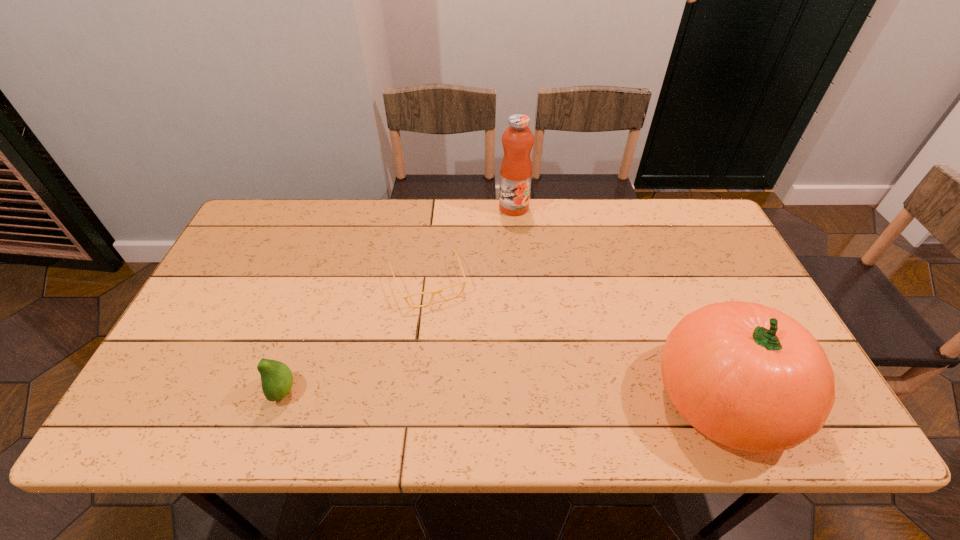
This screenshot has width=960, height=540. Find the location of `avocado`. avocado is located at coordinates (276, 377).

At what (x,y) coordinates should I click in order to perform the action: click on the leftmost object. Please return your answer as a coordinate pair (x, y). Looking at the image, I should click on (276, 377).

Locate an element on the screen. the rightmost object is located at coordinates (748, 376).

Find the location of a particular element. The height and width of the screenshot is (540, 960). the second tallest object is located at coordinates (748, 376).

Image resolution: width=960 pixels, height=540 pixels. I want to click on the second farthest object, so click(x=438, y=291).

The height and width of the screenshot is (540, 960). I want to click on the shortest object, so click(x=438, y=291).

You are a GUI agent. You are given a task and a screenshot of the screen. Output one action in this format:
    pyautogui.click(x=<x>, y=<y>)
    Task: Click on the fruit juice
    This screenshot has height=540, width=960.
    Given the screenshot: What is the action you would take?
    pyautogui.click(x=516, y=167)

Find the location of `the third object from left to right`. the third object from left to right is located at coordinates (516, 167).

What are the coordinates of `free spot located 0.070m on the cut side of the third tallest object` in the screenshot? It's located at point(243,390).

At what (x,y) coordinates should I click in order to perform the action: click on free space located on the cut side of the third tallest object. Please return your answer as a coordinate pair (x, y). Looking at the image, I should click on coord(212,390).